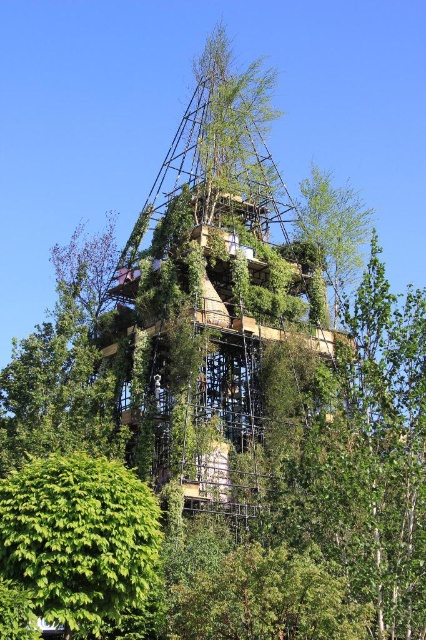
You are a gardener standing at the base of the green leafy tree at lower center and want to water the green leafy bush at lower left. Your hose can reach up to 8 meters. Can you water the bush without moving the hose? Please explain your reasoning.

The distance between the green leafy bush at lower left and the green leafy tree at lower center is 8.65 meters. Since the hose can only reach up to 8 meters, it is not long enough to water the bush from the tree without moving the hose.

You are standing in front of the construction site and see the green leafy bush at lower left and the green leafy tree at lower center. Which one is positioned higher from the ground?

The green leafy bush at lower left is positioned higher from the ground than the green leafy tree at lower center.